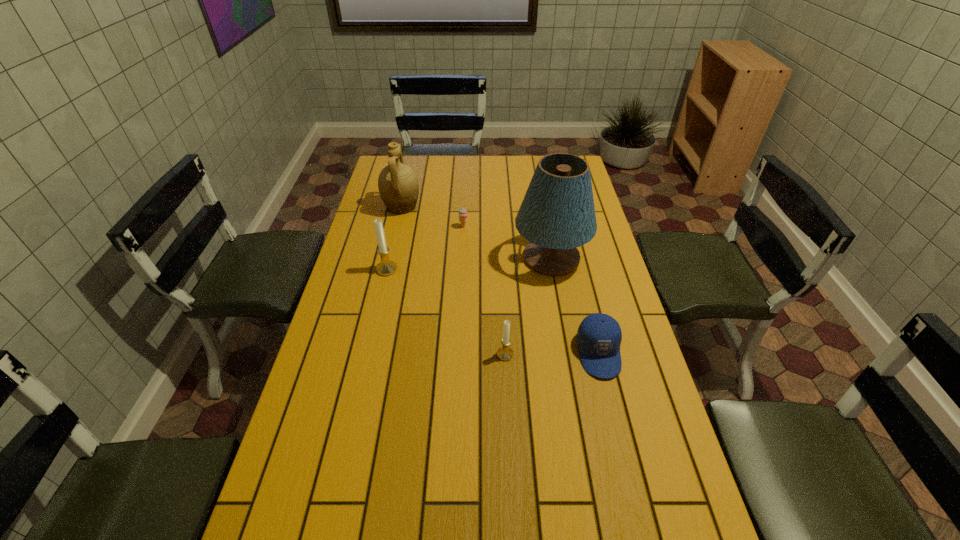
Where is `free space for a new candle holder on the right`? free space for a new candle holder on the right is located at coordinates (686, 485).